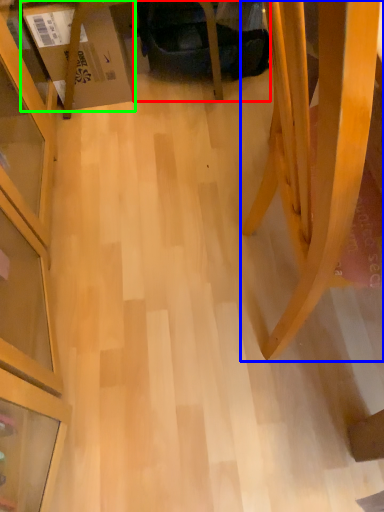
Question: Considering the real-world distances, which object is closest to swivel chair (highlighted by a red box)? furniture (highlighted by a blue box) or cardboard box (highlighted by a green box).

Choices:
 (A) furniture
 (B) cardboard box

Answer: (B)